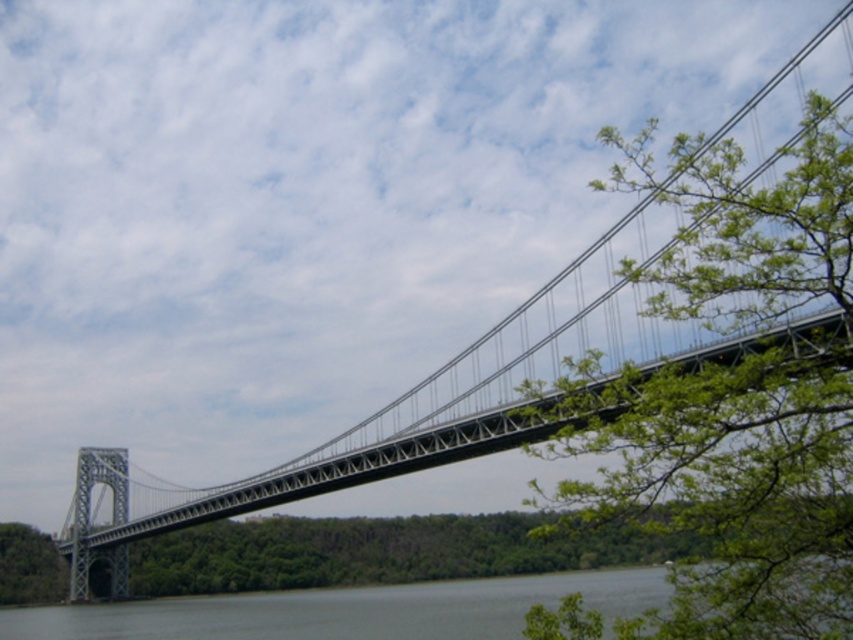
Question: Which point is farther from the camera taking this photo?

Choices:
 (A) (837, 516)
 (B) (50, 556)

Answer: (B)

Question: Can you confirm if green leafy tree at upper right is positioned below green leafy tree at lower left?

Choices:
 (A) yes
 (B) no

Answer: (B)

Question: Which of these objects is positioned farthest from the green leafy tree at lower left?

Choices:
 (A) green leafy tree at upper right
 (B) greenish water at center

Answer: (A)

Question: Does green leafy tree at upper right come in front of green leafy tree at lower left?

Choices:
 (A) yes
 (B) no

Answer: (A)

Question: Which point is closer to the camera taking this photo?

Choices:
 (A) (32, 595)
 (B) (784, 276)

Answer: (B)

Question: Observing the image, what is the correct spatial positioning of greenish water at center in reference to green leafy tree at lower left?

Choices:
 (A) below
 (B) above

Answer: (B)